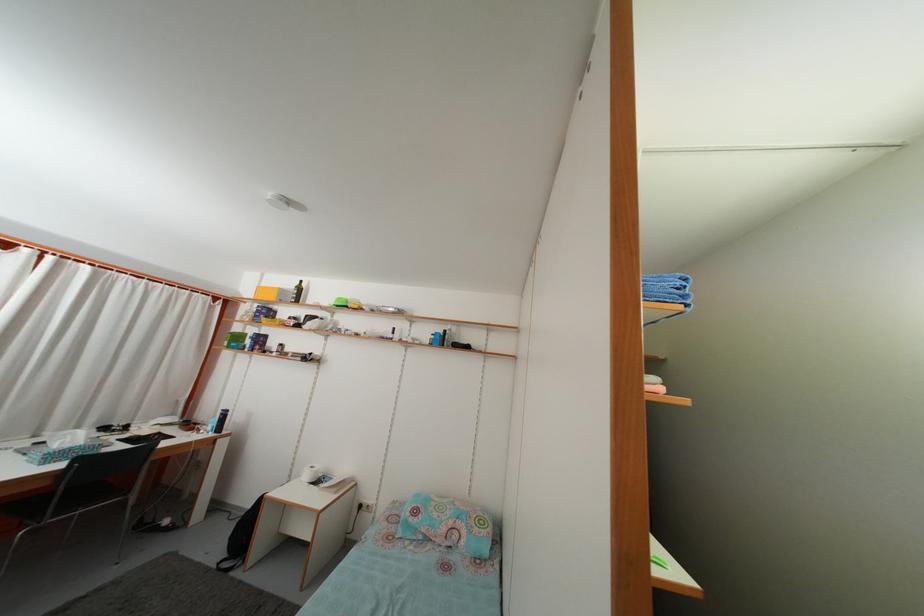
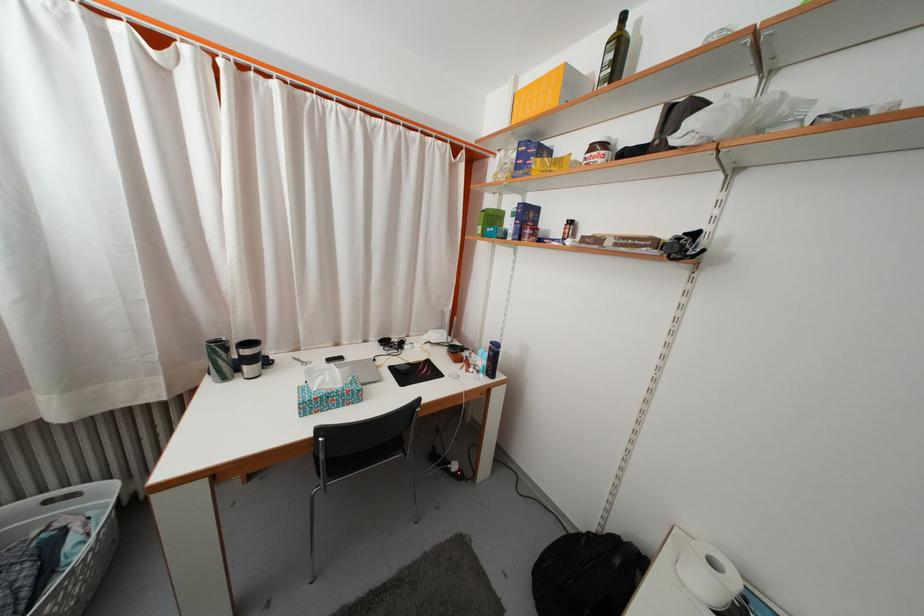
The point at (306, 297) is marked in the first image. Where is the corresponding point in the second image?

(625, 54)